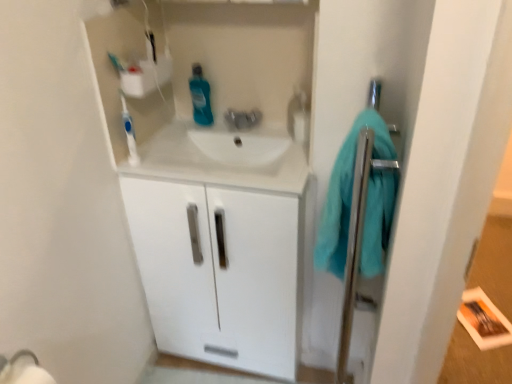
Image resolution: width=512 pixels, height=384 pixels. Identify the location of vacant space that is to the left of blue glossy mouthwash at center. (168, 127).